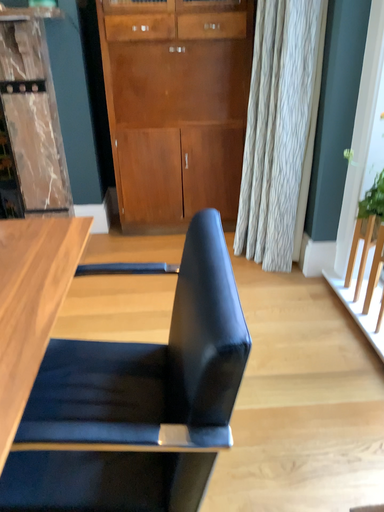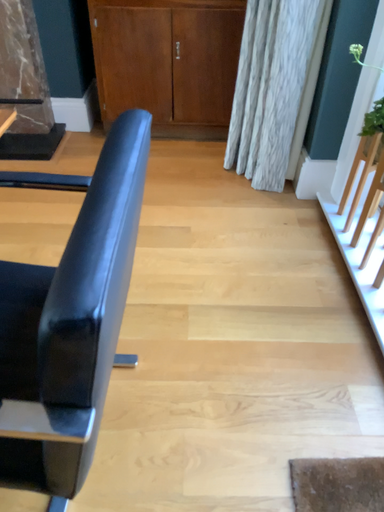
Question: How did the camera likely rotate when shooting the video?

Choices:
 (A) rotated upward
 (B) rotated downward

Answer: (B)